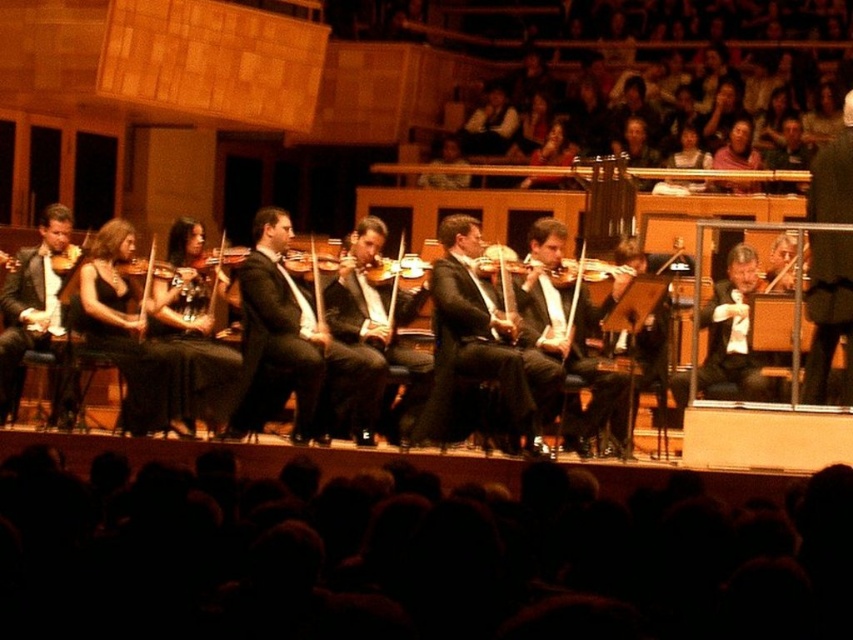
You are a stagehand who needs to place a 3.5 meter long banner between the matte black violin at center and the wooden violin at center. Is there enough space between them to fit the banner?

The distance between the matte black violin at center and the wooden violin at center is 3.12 meters. Since the banner is 3.5 meters long, it is longer than the available space, so the banner cannot be placed between them.

You are a stagehand preparing to move a 1.5 meter long ladder from the stage to the back of the concert hall. You need to pass between the black satin violin at center and the matte black violin at left. Can you safely navigate the space between them with the ladder?

The distance between the black satin violin at center and the matte black violin at left is 13.15 meters. Since the ladder is only 1.5 meters long, there is ample space to safely maneuver the ladder between them without any issues.